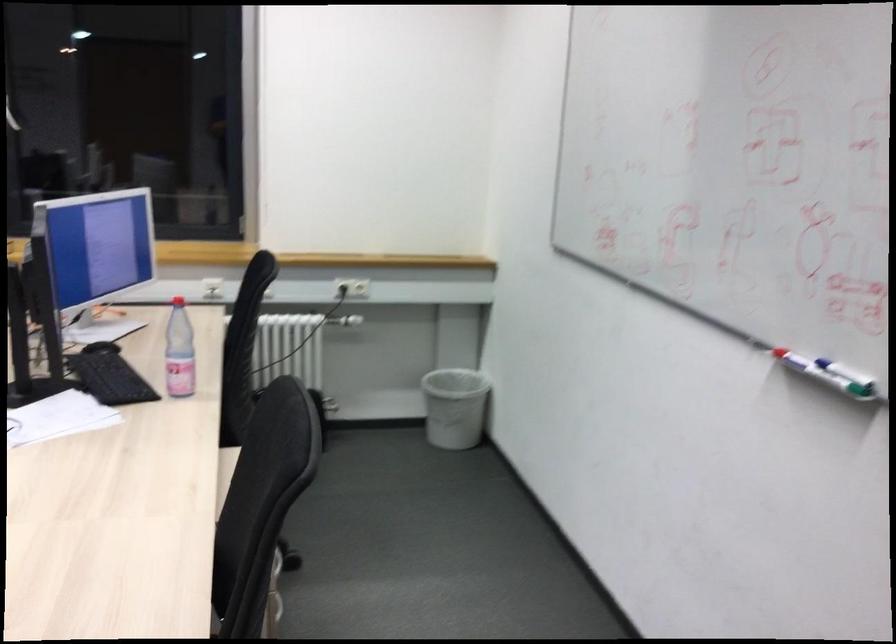
The width and height of the screenshot is (896, 644). Find the location of `power outlet`. power outlet is located at coordinates (352, 287).